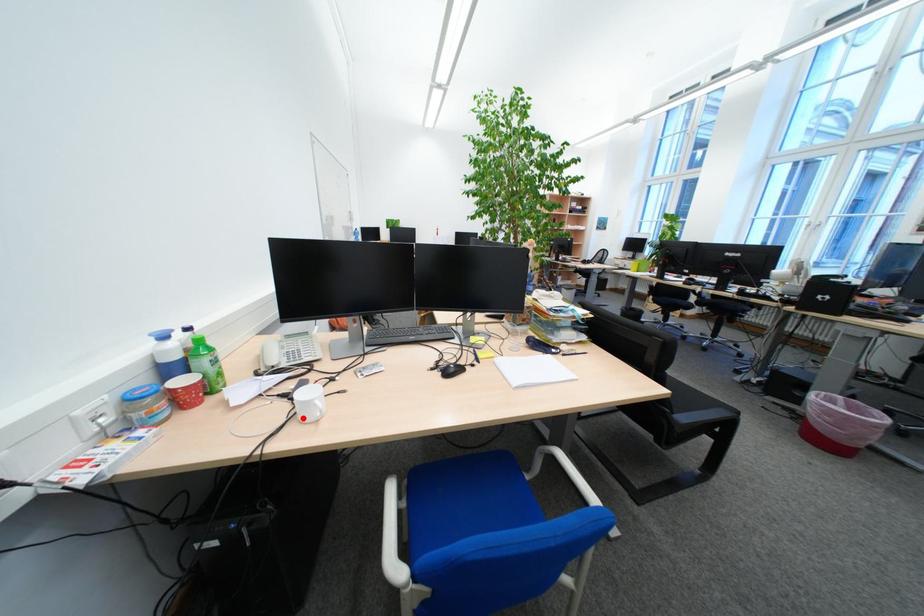
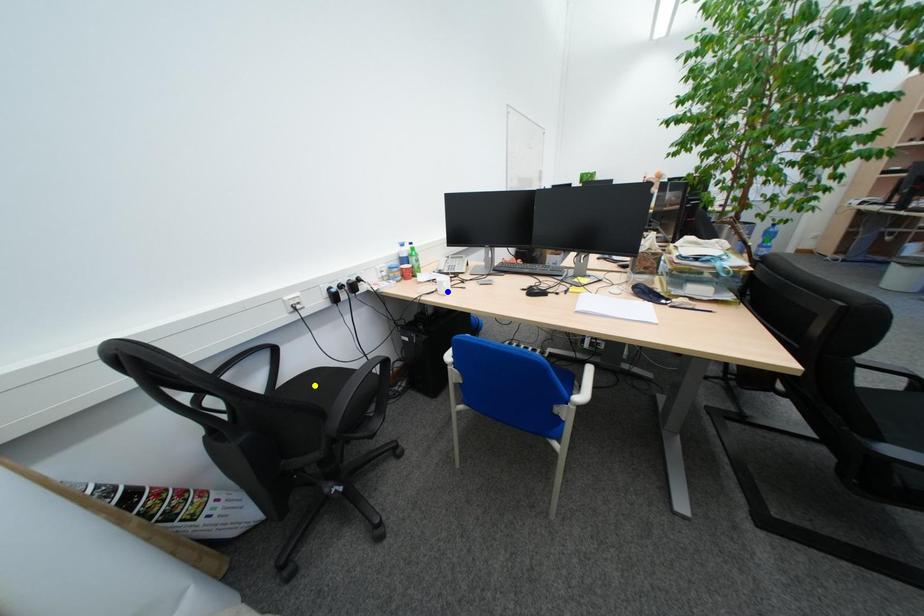
Question: I am providing you with two images of the same scene from different viewpoints. A red point is marked on the first image. You are given multiple points on the second image. Can you choose the point in image 2 that corresponds to the point in image 1?

Choices:
 (A) yellow point
 (B) green point
 (C) blue point

Answer: (C)